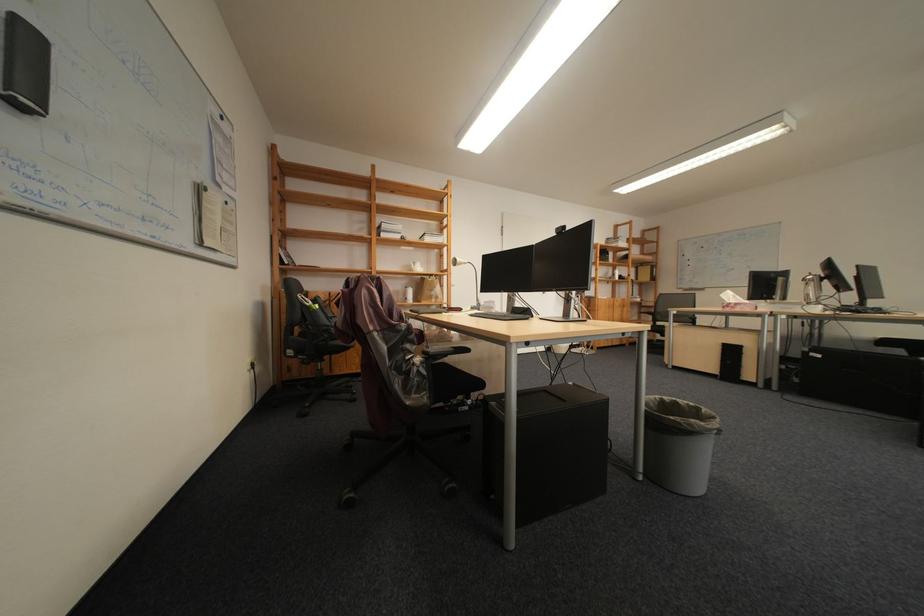
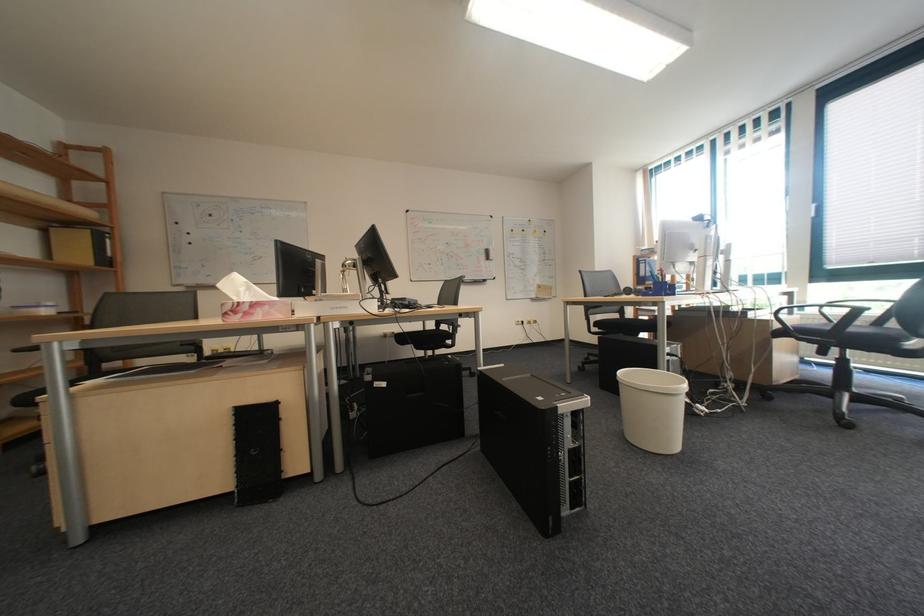
Locate, in the second image, the point that corresponds to point 748,270 in the first image.

(275, 257)